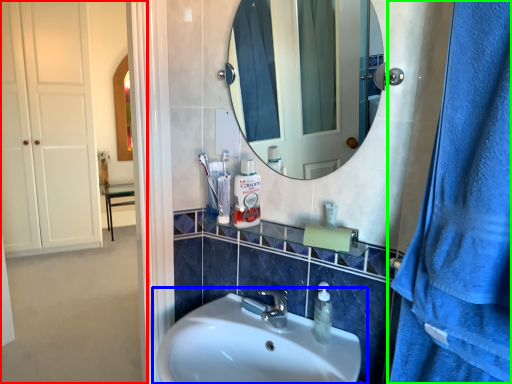
Question: Which is farther away from side (highlighted by a red box)? sink (highlighted by a blue box) or shower curtain (highlighted by a green box)?

Choices:
 (A) sink
 (B) shower curtain

Answer: (B)